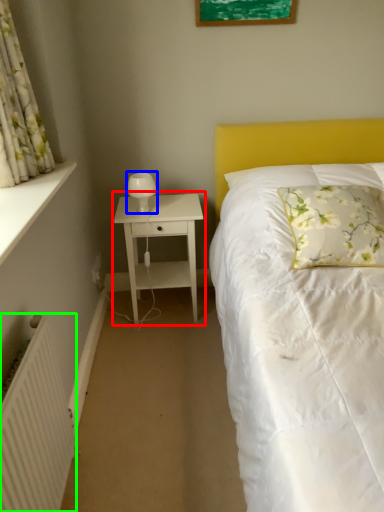
Question: Which is nearer to the nightstand (highlighted by a red box)? bedside lamp (highlighted by a blue box) or radiator (highlighted by a green box).

Choices:
 (A) bedside lamp
 (B) radiator

Answer: (A)